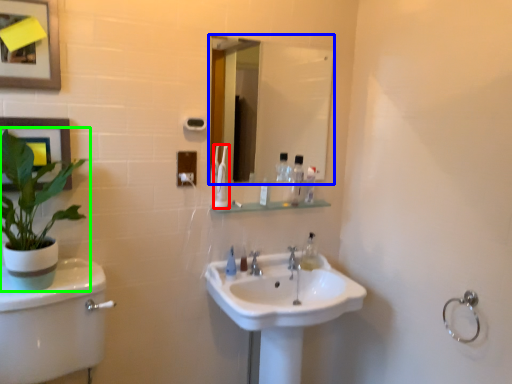
Question: Which object is the closest to the toothbrush (highlighted by a red box)? Choose among these: mirror (highlighted by a blue box) or houseplant (highlighted by a green box).

Choices:
 (A) mirror
 (B) houseplant

Answer: (B)